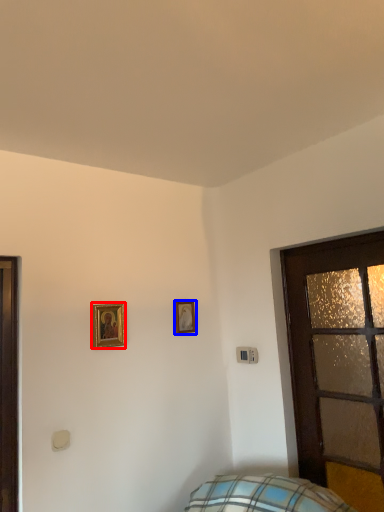
Question: Which object appears closest to the camera in this image, picture frame (highlighted by a red box) or picture frame (highlighted by a blue box)?

Choices:
 (A) picture frame
 (B) picture frame

Answer: (A)